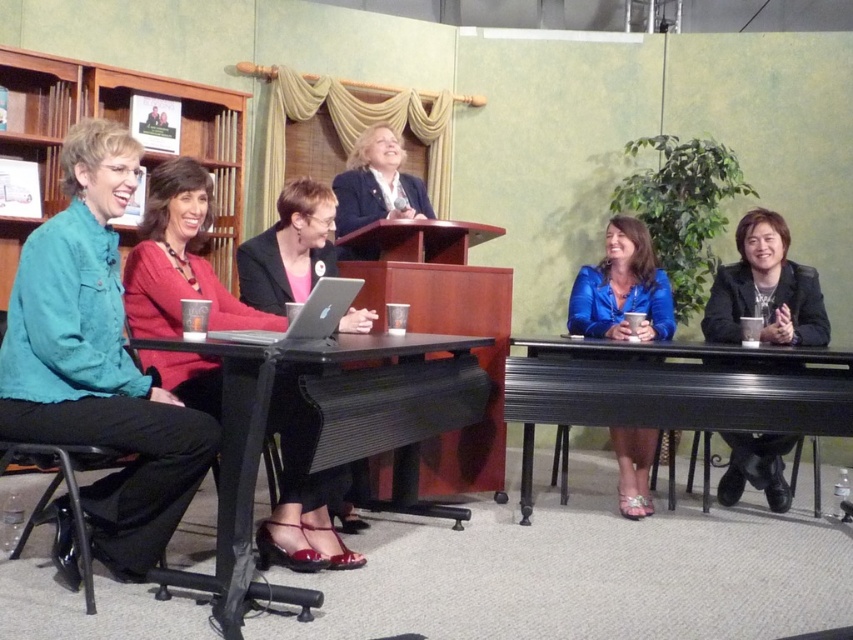
You are attending a panel discussion and need to place a name tag on the table closest to the speaker. The speaker is wearing a matte black blazer at center. Which direction should you move from the speaker to reach the black metal table at lower right?

The black metal table at lower right is to the right of the matte black blazer at center, so you should move to the right to reach it.

You are a photographer standing at the point marked as point (672, 388). You want to take a photo of the podium in the center. Is the black metal table at lower right blocking your view of the podium?

The point (672, 388) is on the black metal table at lower right. Since the black metal table is at the lower right, it might block the view to the center where the podium is located. However, without knowing the exact positions and angles, it is impossible to determine for sure.

You are sitting at the black plastic table at lower left and want to hand a document to the person wearing the black leather jacket at right. Which direction should you move to reach them?

The black plastic table at lower left is to the left of the black leather jacket at right, so you should move to your right to reach them.